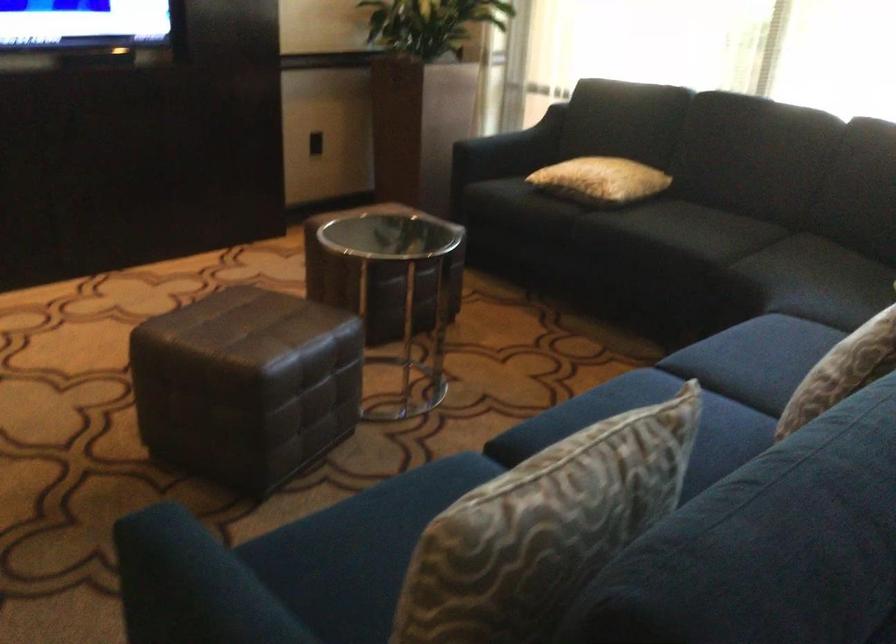
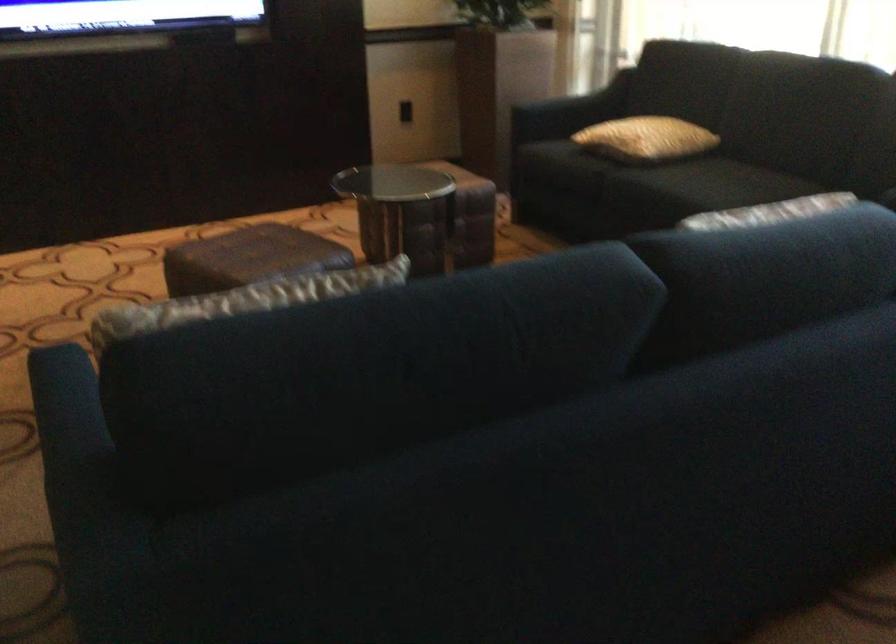
In the second image, find the point that corresponds to (x=688, y=229) in the first image.

(709, 184)